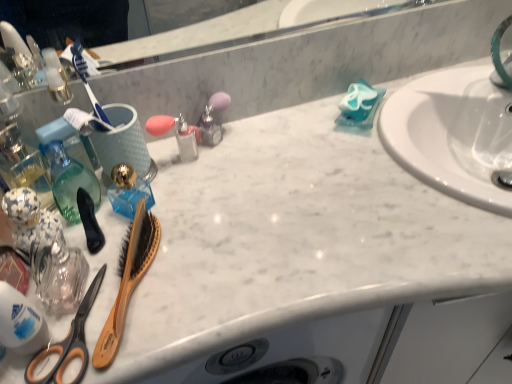
At what (x,y) coordinates should I click in order to perform the action: click on free spot to the right of black rubber brush at left, which is the first brush in left-to-right order. Please return your answer as a coordinate pair (x, y). The width and height of the screenshot is (512, 384). Looking at the image, I should click on (206, 237).